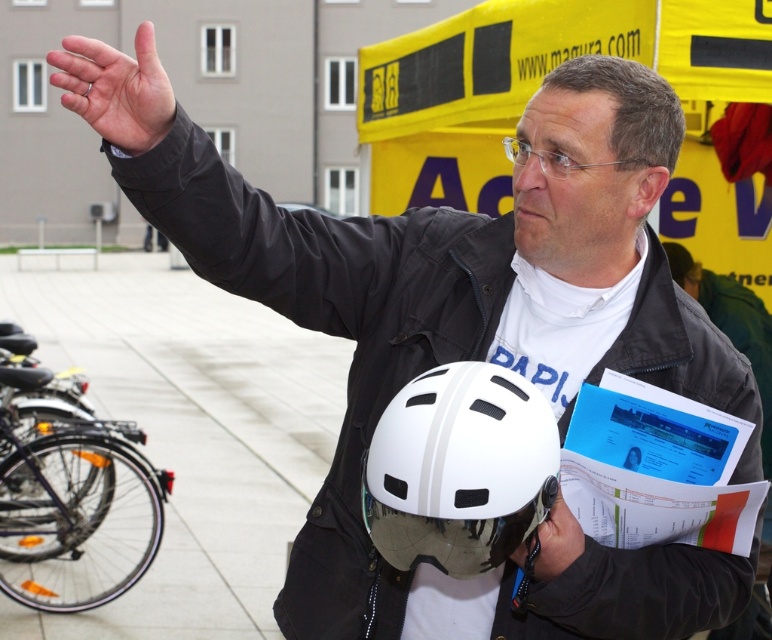
Does matte black hand at upper left appear on the left side of white matte helmet at lower center?

Indeed, matte black hand at upper left is positioned on the left side of white matte helmet at lower center.

Who is more forward, (127, 129) or (577, 545)?

Point (127, 129)

Who is more forward, [156,138] or [574,525]?

Point [156,138]

You are a GUI agent. You are given a task and a screenshot of the screen. Output one action in this format:
    pyautogui.click(x=<x>, y=<y>)
    Task: Click on the matte black hand at upper left
    The image size is (772, 640).
    Given the screenshot: What is the action you would take?
    pyautogui.click(x=117, y=90)

Which is below, white matte helmet at center or matte black hand at upper left?

white matte helmet at center is below.

Between white matte helmet at center and matte black hand at upper left, which one has more height?

With more height is matte black hand at upper left.

I want to click on white matte helmet at center, so click(x=459, y=468).

Image resolution: width=772 pixels, height=640 pixels. In order to click on white matte helmet at center in this screenshot , I will do `click(459, 468)`.

Is white matte helmet at center in front of white matte helmet at lower center?

Yes, it is in front of white matte helmet at lower center.

Does white matte helmet at center have a larger size compared to white matte helmet at lower center?

Correct, white matte helmet at center is larger in size than white matte helmet at lower center.

Is point (483, 394) behind point (547, 531)?

No.

Locate an element on the screen. white matte helmet at center is located at coordinates (459, 468).